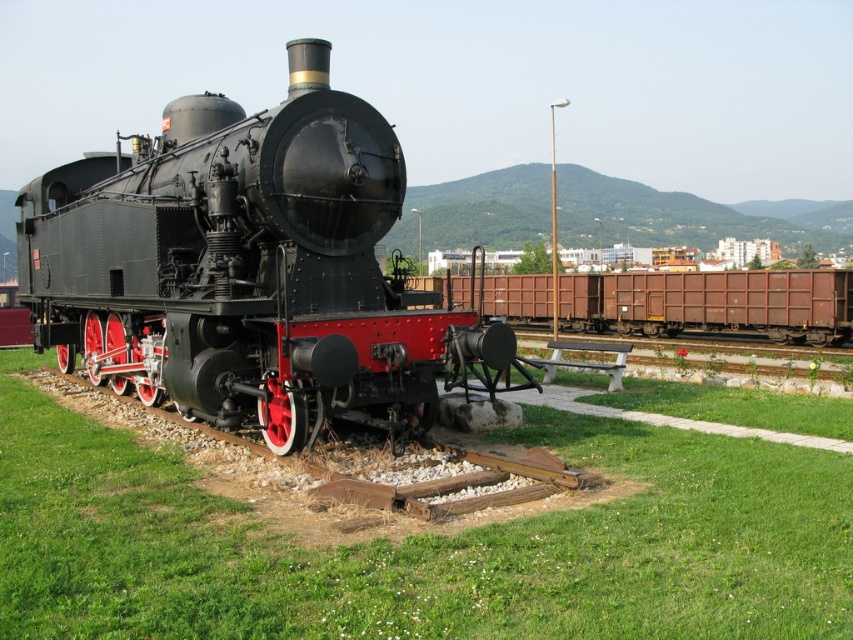
Does polished black steam locomotive at center come behind rusty metal train car at center?

No, it is not.

The image size is (853, 640). Find the location of `polished black steam locomotive at center`. polished black steam locomotive at center is located at coordinates (250, 268).

Is point (437, 307) farther from viewer compared to point (621, 317)?

No, it is in front of (621, 317).

Identify the location of polished black steam locomotive at center. Image resolution: width=853 pixels, height=640 pixels. (250, 268).